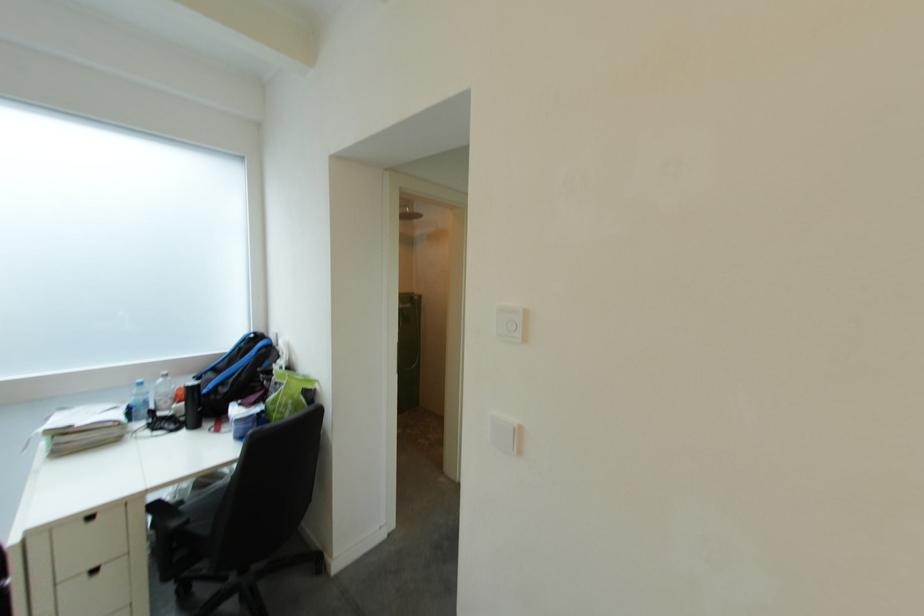
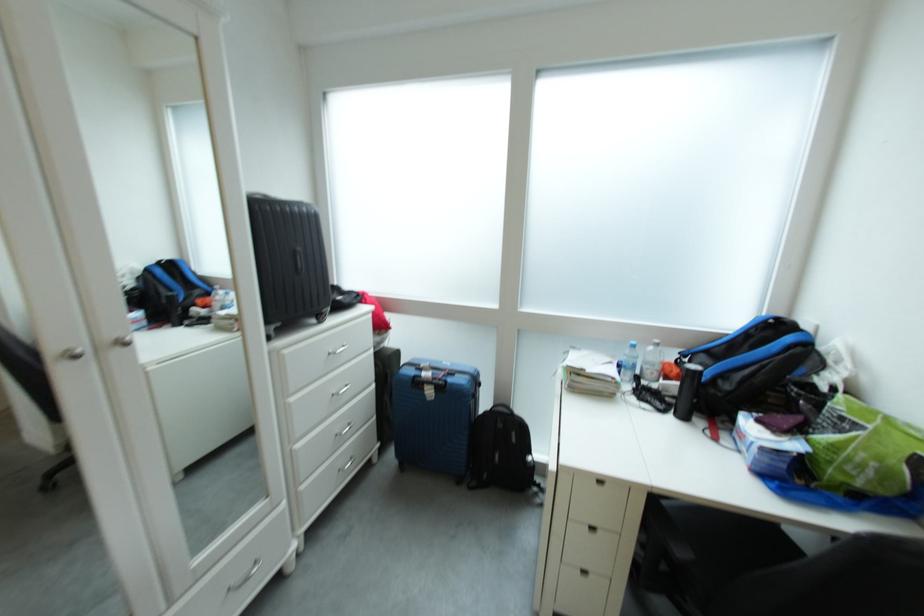
Where in the second image is the point corresponding to the point at 235,392 from the first image?

(737, 390)